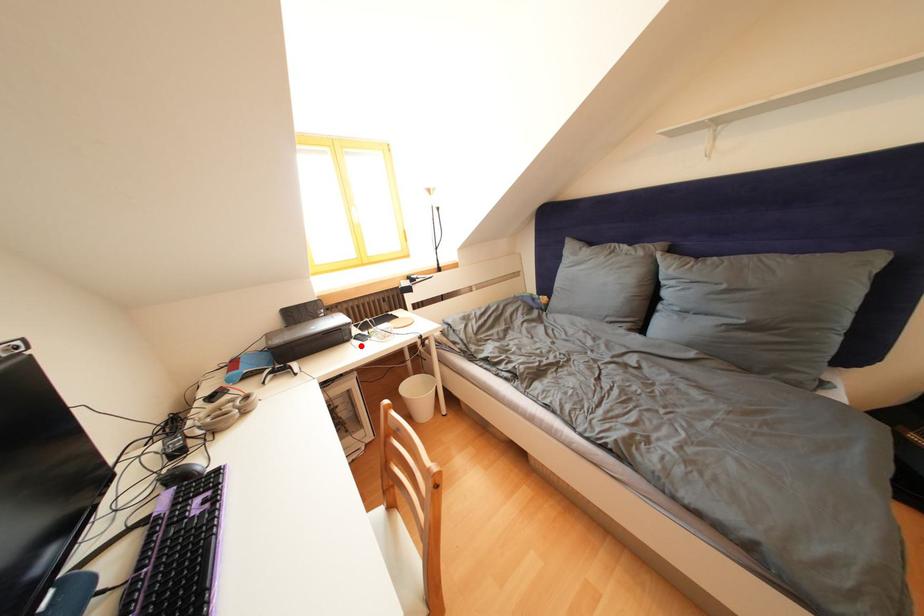
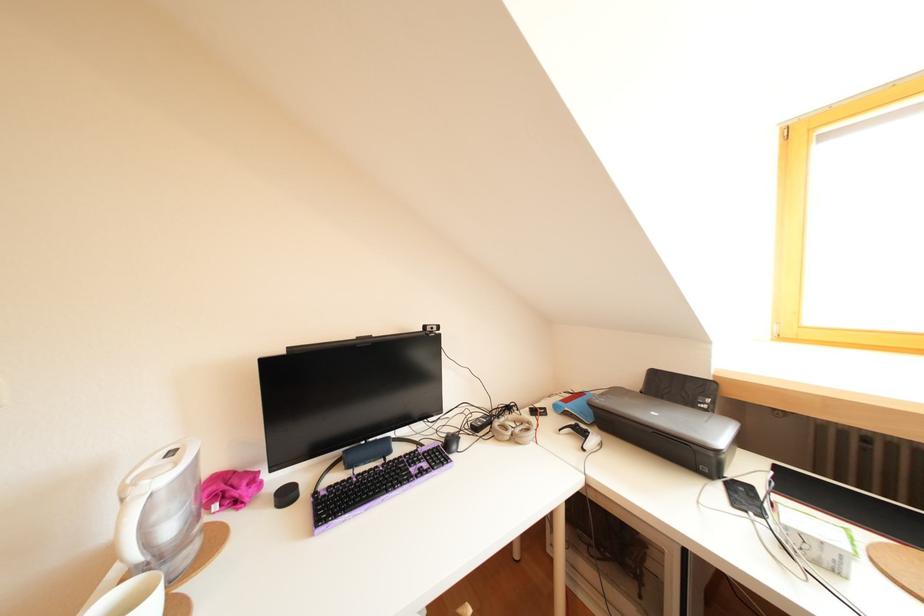
Where in the second image is the point corresponding to the highlighted location from the first image?

(727, 490)